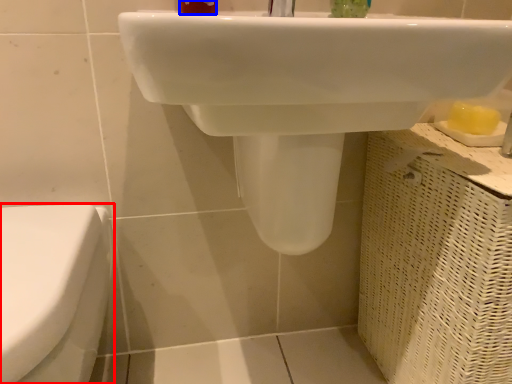
Question: Among these objects, which one is nearest to the camera, toilet (highlighted by a red box) or toiletry (highlighted by a blue box)?

Choices:
 (A) toilet
 (B) toiletry

Answer: (A)